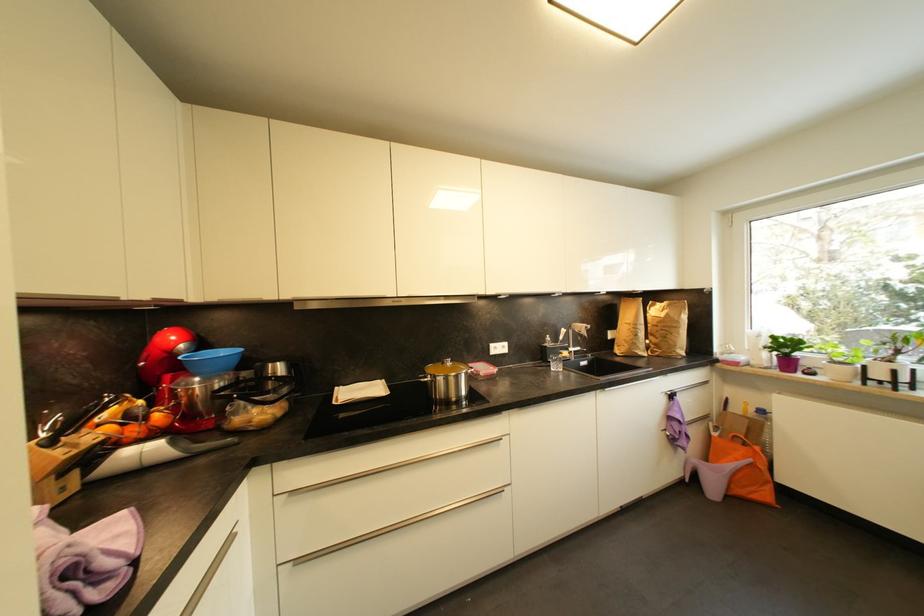
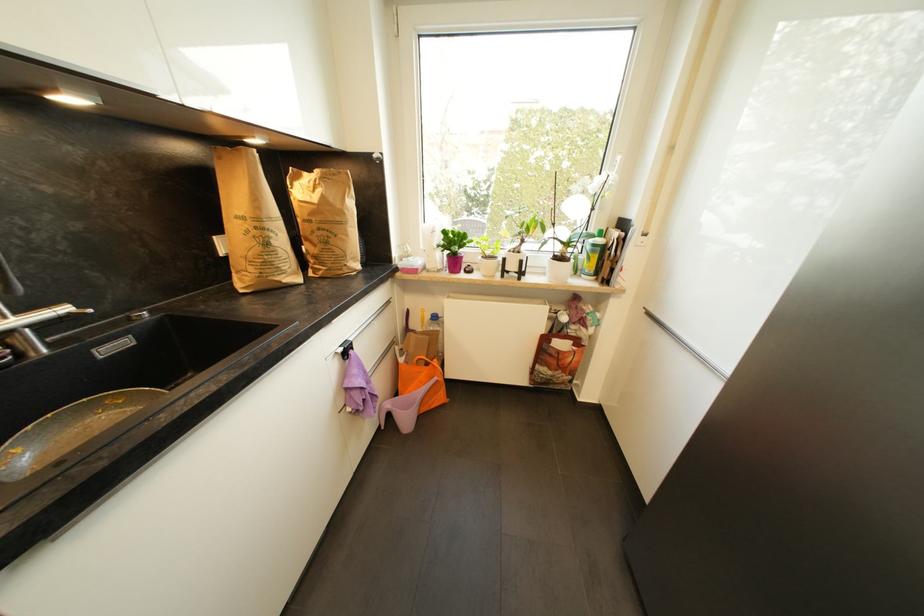
Where in the second image is the point corresponding to point 883,377 from the first image?

(517, 268)